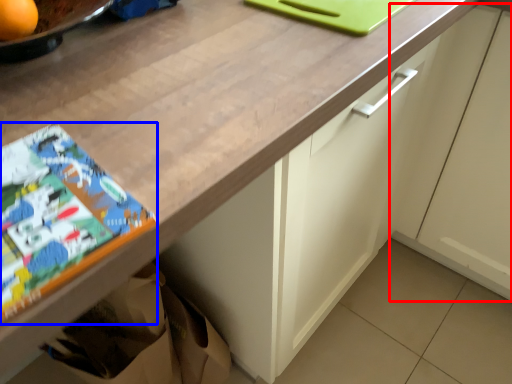
Question: Which of the following is the closest to the observer, cabinetry (highlighted by a red box) or comic book (highlighted by a blue box)?

Choices:
 (A) cabinetry
 (B) comic book

Answer: (B)